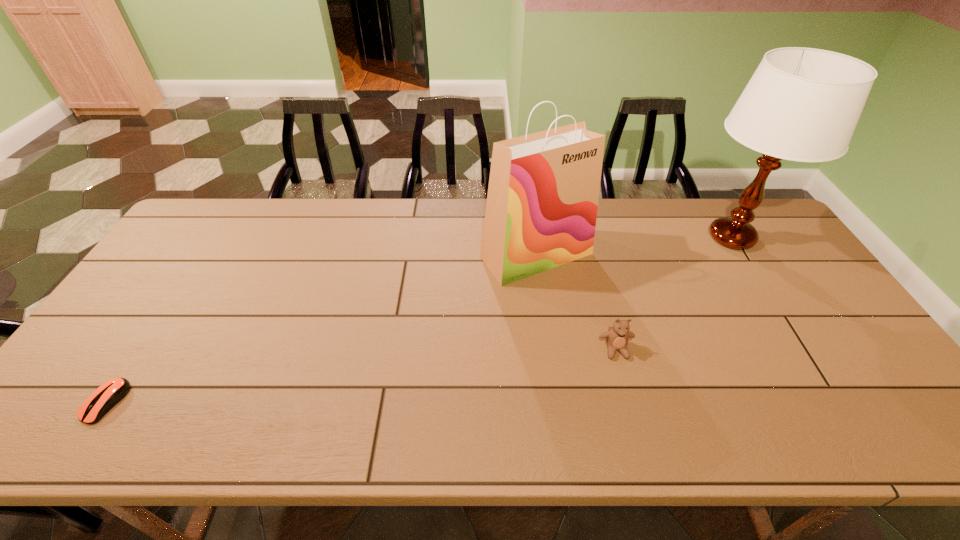
You are a GUI agent. You are given a task and a screenshot of the screen. Output one action in this format:
    pyautogui.click(x=<x>, y=<y>)
    Task: Click on the table lamp
    This screenshot has height=540, width=960.
    Given the screenshot: What is the action you would take?
    click(802, 104)

Where is `shopping bag`? The height and width of the screenshot is (540, 960). shopping bag is located at coordinates (542, 201).

This screenshot has height=540, width=960. Identify the location of the third farthest object. (617, 338).

This screenshot has width=960, height=540. In order to click on the third tallest object in this screenshot , I will do `click(617, 338)`.

Locate an element on the screen. The width and height of the screenshot is (960, 540). the shortest object is located at coordinates (104, 398).

Locate an element on the screen. the leftmost object is located at coordinates (104, 398).

The width and height of the screenshot is (960, 540). In order to click on free space located 0.120m on the left of the rightmost object in this screenshot , I will do coord(649,237).

Where is `blank space located 0.070m on the left of the shopping bag`? The height and width of the screenshot is (540, 960). blank space located 0.070m on the left of the shopping bag is located at coordinates (458, 255).

The height and width of the screenshot is (540, 960). Identify the location of vacant region located on the front-facing side of the third tallest object. [624, 378].

Identify the location of free space located 0.400m on the back of the computer mouse. (196, 266).